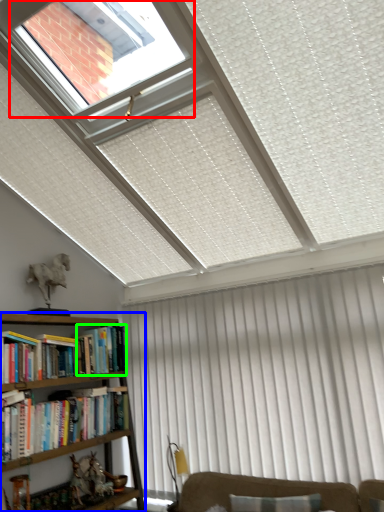
Question: Estimate the real-world distances between objects in this image. Which object is farther from bay window (highlighted by a red box), bookcase (highlighted by a blue box) or book (highlighted by a green box)?

Choices:
 (A) bookcase
 (B) book

Answer: (A)